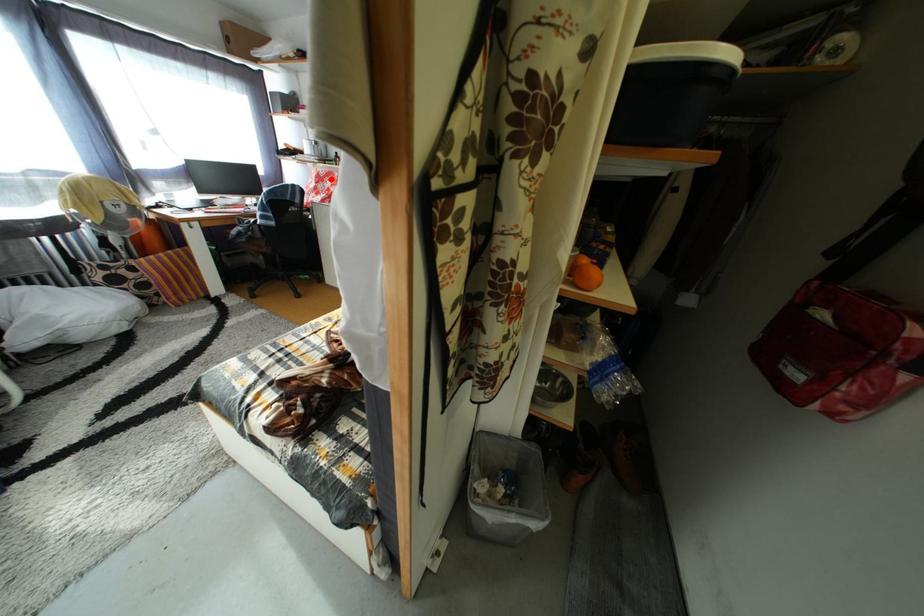
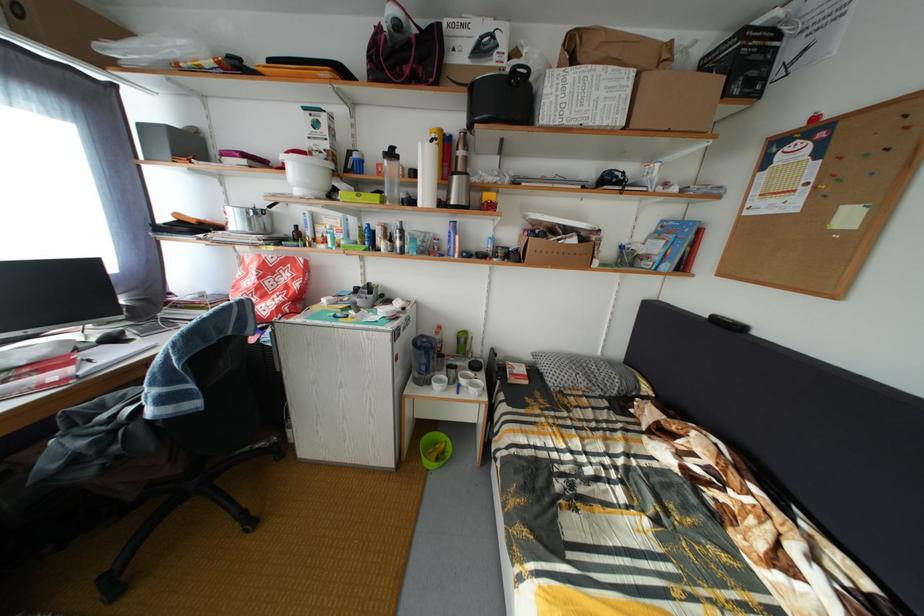
Where in the second image is the point corresponding to the highlighted location from the first image?

(281, 267)